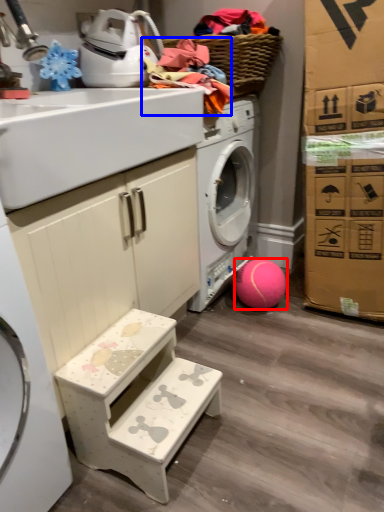
Question: Which object appears closest to the camera in this image, ball (highlighted by a red box) or clothing (highlighted by a blue box)?

Choices:
 (A) ball
 (B) clothing

Answer: (B)